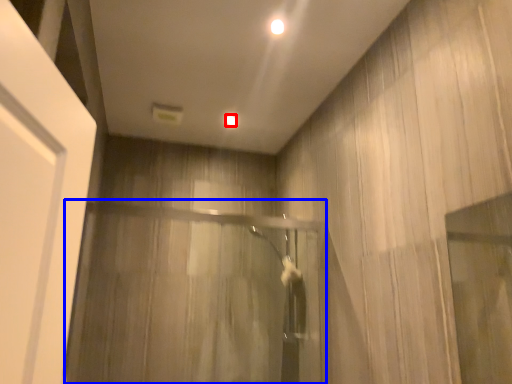
Question: Which point is further to the camera, lighting (highlighted by a red box) or screen door (highlighted by a blue box)?

Choices:
 (A) lighting
 (B) screen door

Answer: (A)